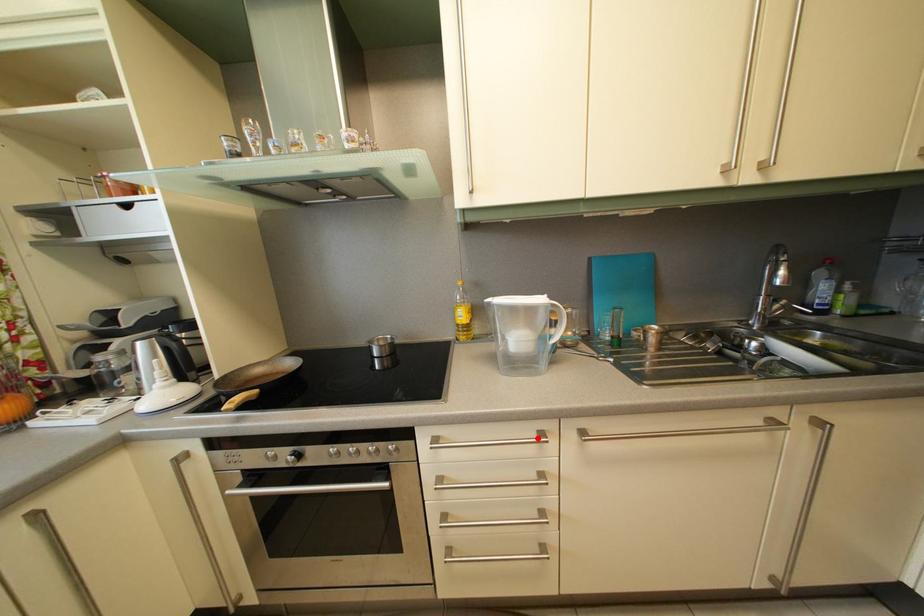
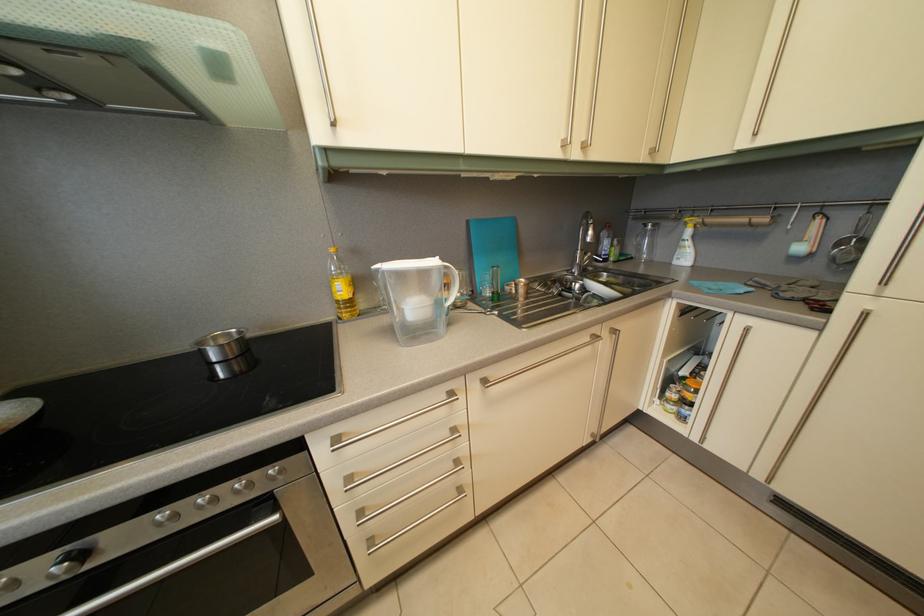
In the second image, find the point that corresponds to the highlighted location in the first image.

(447, 402)